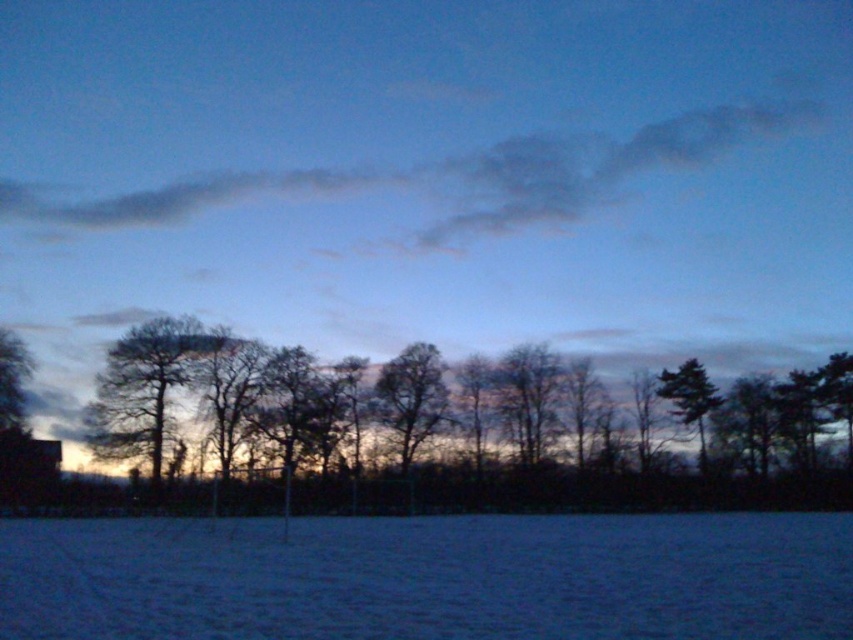
Question: Is dark gray cloud at upper center bigger than green matte tree at right?

Choices:
 (A) no
 (B) yes

Answer: (B)

Question: Which object is closer to the camera taking this photo?

Choices:
 (A) green matte tree at right
 (B) brown textured tree at center
 (C) dark gray cloud at upper center

Answer: (B)

Question: Does dark brown tree at center appear under dark gray cloud at upper center?

Choices:
 (A) yes
 (B) no

Answer: (A)

Question: Which object is the farthest from the dark gray cloud at upper center?

Choices:
 (A) dark brown tree at center
 (B) silhouette bare tree at left
 (C) green matte tree at right

Answer: (B)

Question: Which is nearer to the silhouette bare tree at left?

Choices:
 (A) dark brown tree at center
 (B) silhouette bark tree at left
 (C) green matte tree at right
 (D) brown textured tree at center

Answer: (B)

Question: Is green matte tree at right thinner than silhouette bare tree at left?

Choices:
 (A) no
 (B) yes

Answer: (A)